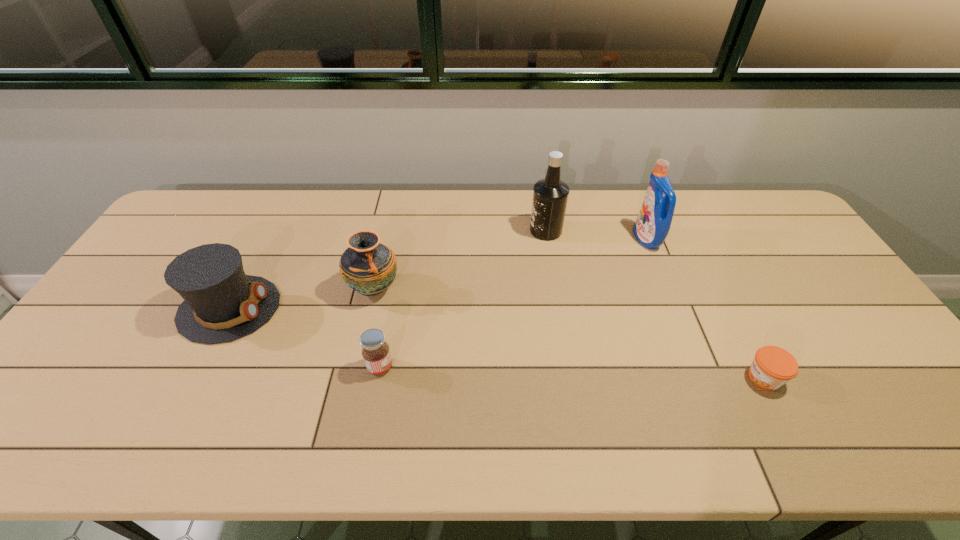
Where is `vacant space positioned on the front label of the third object from right to left`? The image size is (960, 540). vacant space positioned on the front label of the third object from right to left is located at coordinates (505, 231).

At what (x,y) coordinates should I click in order to perform the action: click on vacant area located 0.340m on the front label of the third object from right to left. Please return your answer as a coordinate pair (x, y). Looking at the image, I should click on (427, 231).

The width and height of the screenshot is (960, 540). What are the coordinates of `vacant area situated 0.110m on the label of the detergent` in the screenshot? It's located at (601, 239).

Locate an element on the screen. This screenshot has height=540, width=960. free spot located 0.310m on the label of the detergent is located at coordinates (540, 239).

The image size is (960, 540). Identify the location of vacant space located on the label of the detergent. [552, 239].

What are the coordinates of `free space located on the left of the pottery` in the screenshot? It's located at (293, 289).

You are a GUI agent. You are given a task and a screenshot of the screen. Output one action in this format:
    pyautogui.click(x=<x>, y=<y>)
    Task: Click on the vacant space located 0.350m with goggles on the front of the dress hat
    Image resolution: width=960 pixels, height=540 pixels.
    Given the screenshot: What is the action you would take?
    pyautogui.click(x=404, y=308)

Find the location of `free space located on the label side of the taller jam`. free space located on the label side of the taller jam is located at coordinates (473, 367).

The width and height of the screenshot is (960, 540). Identify the location of free spot located 0.090m on the front label of the rightmost object. (708, 377).

In order to click on free space located 0.390m on the front label of the rightmost object in this screenshot , I will do `click(586, 377)`.